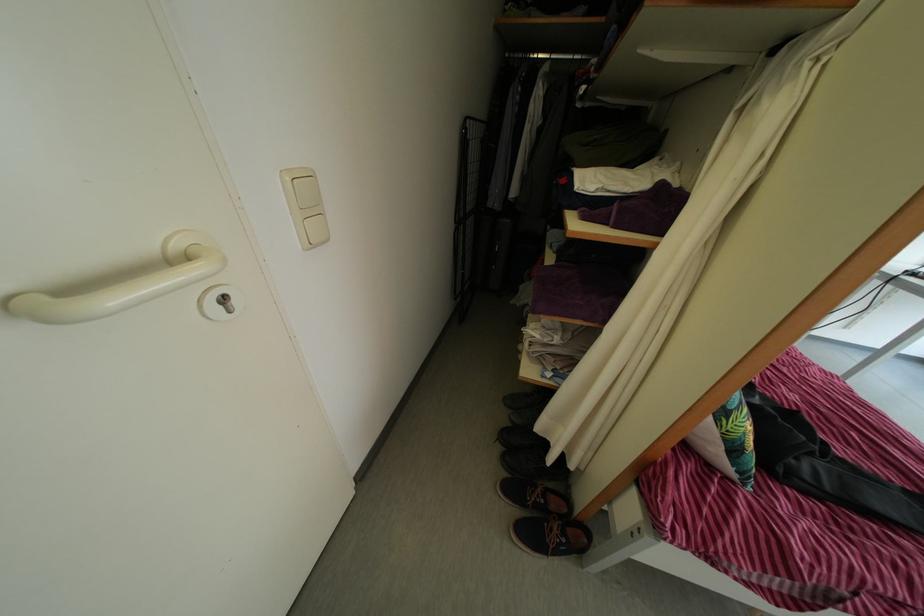
Locate an element on the screen. light switch button is located at coordinates (306, 207).